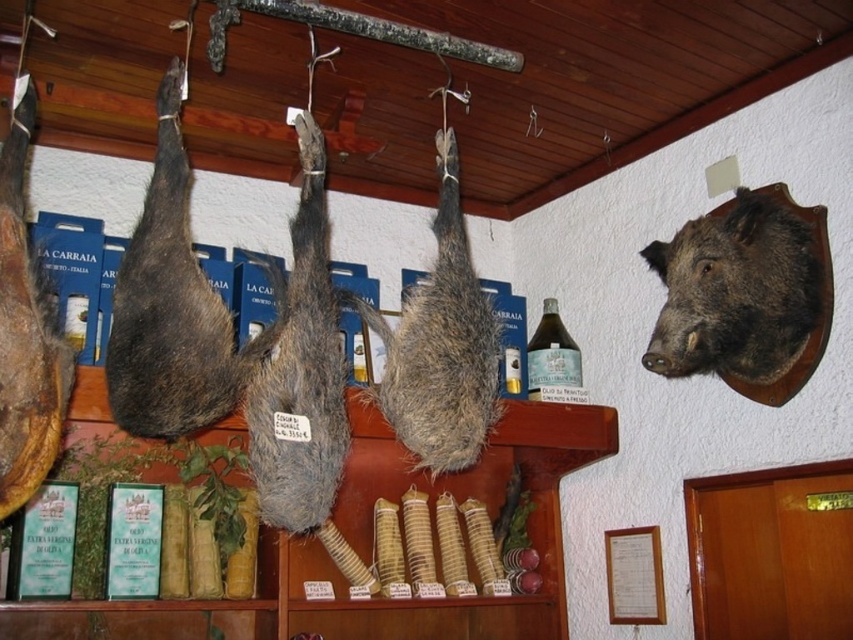
Question: Among these points, which one is nearest to the camera?

Choices:
 (A) (403, 435)
 (B) (3, 513)
 (C) (317, 348)
 (D) (204, 378)

Answer: (B)

Question: Which object appears farthest from the camera in this image?

Choices:
 (A) brown furry ham at upper left
 (B) fuzzy fur boar at center
 (C) brown leather shelf at center

Answer: (C)

Question: Does fuzzy fur boar at center have a lesser width compared to brown leather ham at left?

Choices:
 (A) yes
 (B) no

Answer: (B)

Question: Considering the relative positions of dark brown fur head at upper right and brown leather ham at left in the image provided, where is dark brown fur head at upper right located with respect to brown leather ham at left?

Choices:
 (A) right
 (B) left

Answer: (A)

Question: Is dark brown fur head at upper right smaller than fuzzy fur pig at center?

Choices:
 (A) yes
 (B) no

Answer: (A)

Question: Among these objects, which one is farthest from the camera?

Choices:
 (A) fuzzy fur boar at center
 (B) dark brown fur head at upper right
 (C) brown leather ham at left
 (D) fuzzy fur pig at center

Answer: (B)